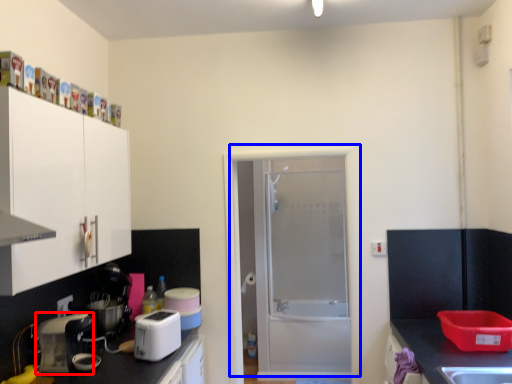
Question: Which object appears closest to the camera in this image, kitchen appliance (highlighted by a red box) or door (highlighted by a blue box)?

Choices:
 (A) kitchen appliance
 (B) door

Answer: (A)